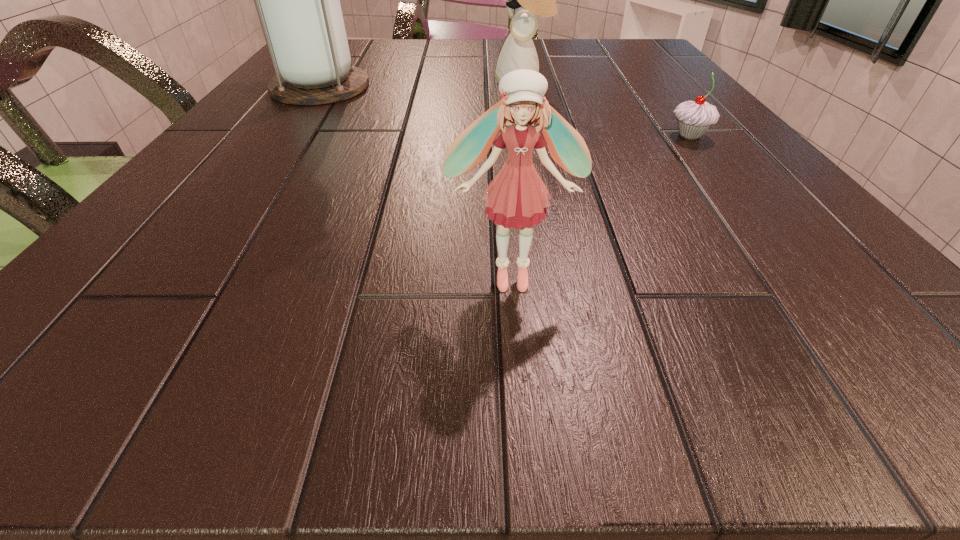
The height and width of the screenshot is (540, 960). Identify the location of blank space that satisfies the following two spatial constraints: 1. at the front face of the third farthest object; 2. on the left side of the taller doll. click(x=533, y=136).

The height and width of the screenshot is (540, 960). Find the location of `vacant region that satisfies the following two spatial constraints: 1. at the front face of the cupcake; 2. on the right side of the taller doll`. vacant region that satisfies the following two spatial constraints: 1. at the front face of the cupcake; 2. on the right side of the taller doll is located at coordinates (533, 136).

I want to click on free space that satisfies the following two spatial constraints: 1. at the front face of the farther doll; 2. on the front side of the lantern, so click(x=523, y=87).

Locate an element on the screen. vacant region that satisfies the following two spatial constraints: 1. at the front face of the farther doll; 2. on the front-facing side of the nearest object is located at coordinates pyautogui.click(x=561, y=276).

Identify the location of vacant space that satisfies the following two spatial constraints: 1. on the back side of the cupcake; 2. at the front face of the taller doll. (649, 83).

The width and height of the screenshot is (960, 540). Identify the location of vacant point that satisfies the following two spatial constraints: 1. at the front face of the shortest object; 2. on the right side of the taller doll. (533, 136).